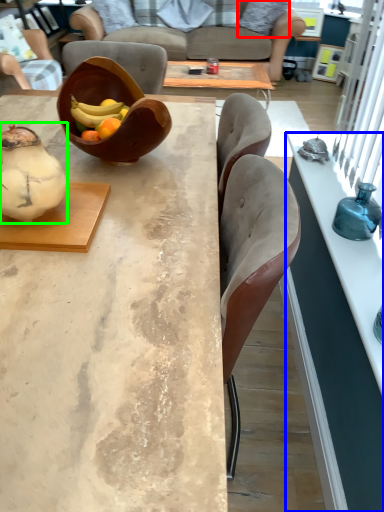
Question: Which is farther away from pillow (highlighted by a red box)? desk (highlighted by a blue box) or tea pot (highlighted by a green box)?

Choices:
 (A) desk
 (B) tea pot

Answer: (B)